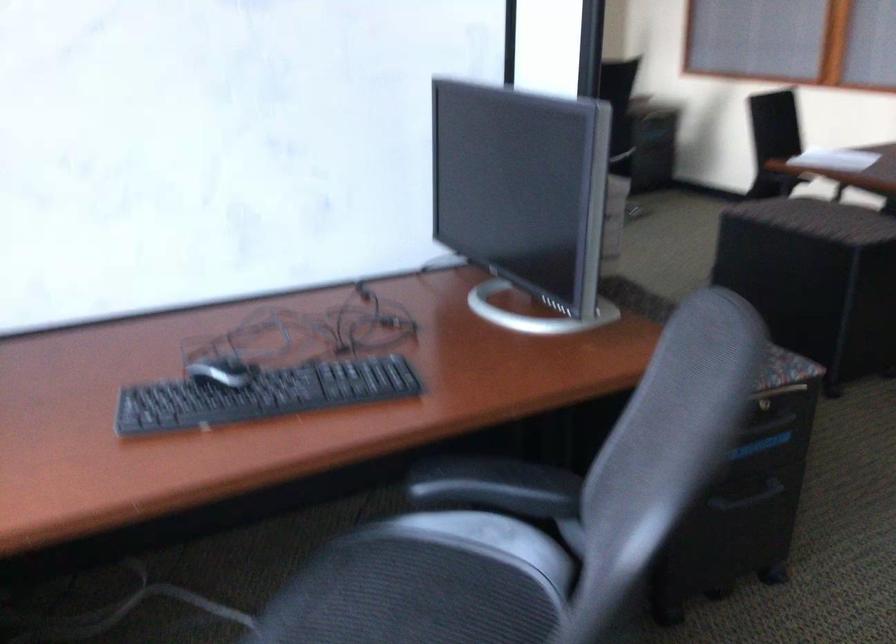
Find where to pull the cabinet drawer handle. Please return your answer as a coordinate pair (x, y).

(747, 497)